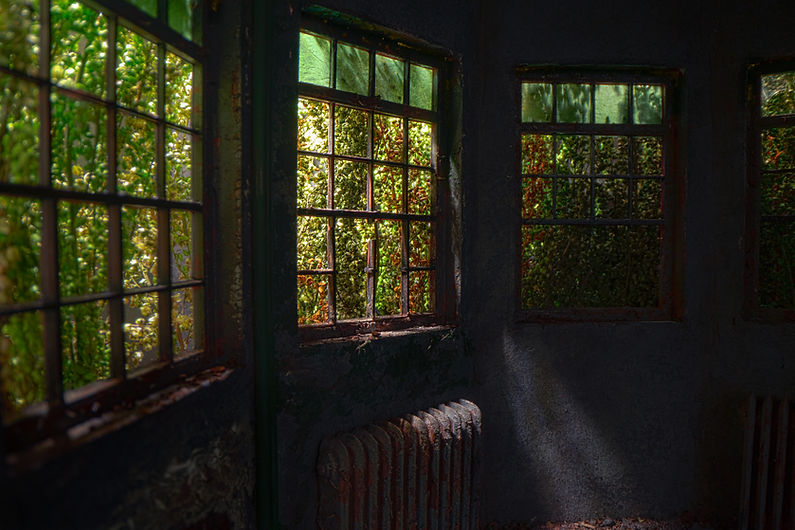
Locate an element on the screen. This screenshot has height=530, width=795. tinted glass is located at coordinates (610, 108), (355, 80).